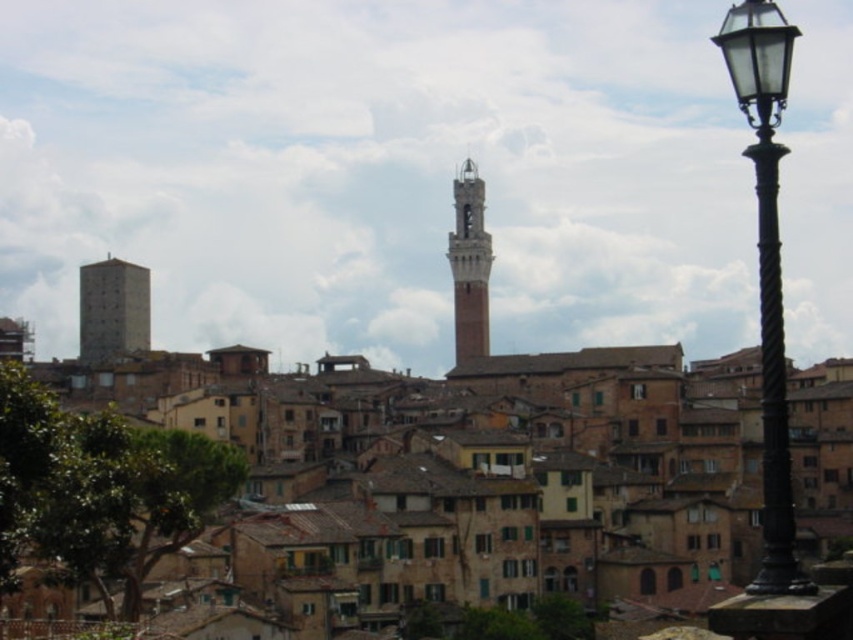
Does black metal street light at right have a lesser height compared to gray stone tower at left?

No, black metal street light at right is not shorter than gray stone tower at left.

Find the location of `black metal street light at right`. black metal street light at right is located at coordinates (767, 266).

The height and width of the screenshot is (640, 853). Describe the element at coordinates (767, 266) in the screenshot. I see `black metal street light at right` at that location.

Is black metal street light at right above brick tower at center?

No.

The image size is (853, 640). Find the location of `black metal street light at right`. black metal street light at right is located at coordinates (767, 266).

Does gray stone tower at left lie in front of brick tower at center?

Yes, gray stone tower at left is in front of brick tower at center.

Does gray stone tower at left have a lesser width compared to brick tower at center?

Incorrect, gray stone tower at left's width is not less than brick tower at center's.

Who is more distant from viewer, (108, 294) or (456, 321)?

The point (456, 321) is more distant.

Locate an element on the screen. This screenshot has height=640, width=853. gray stone tower at left is located at coordinates (113, 308).